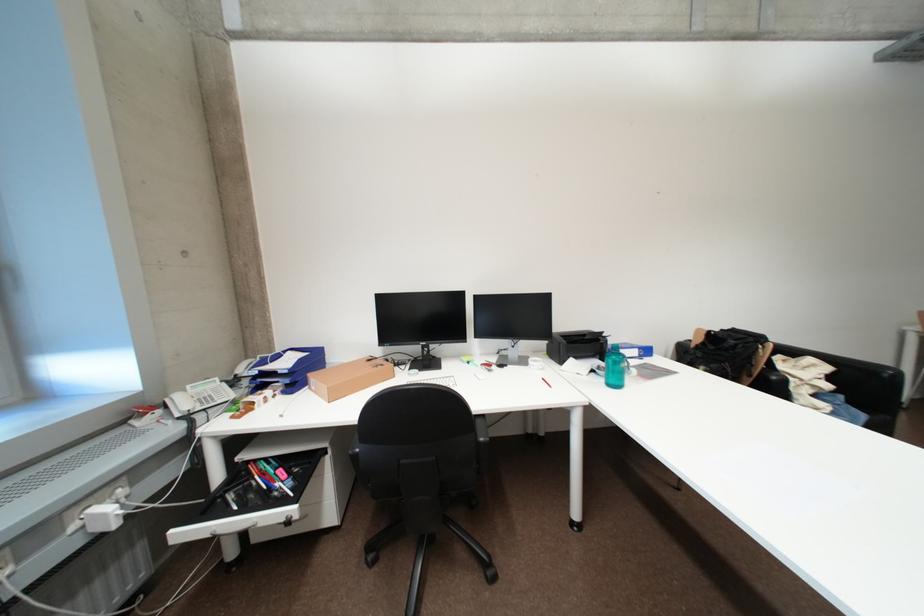
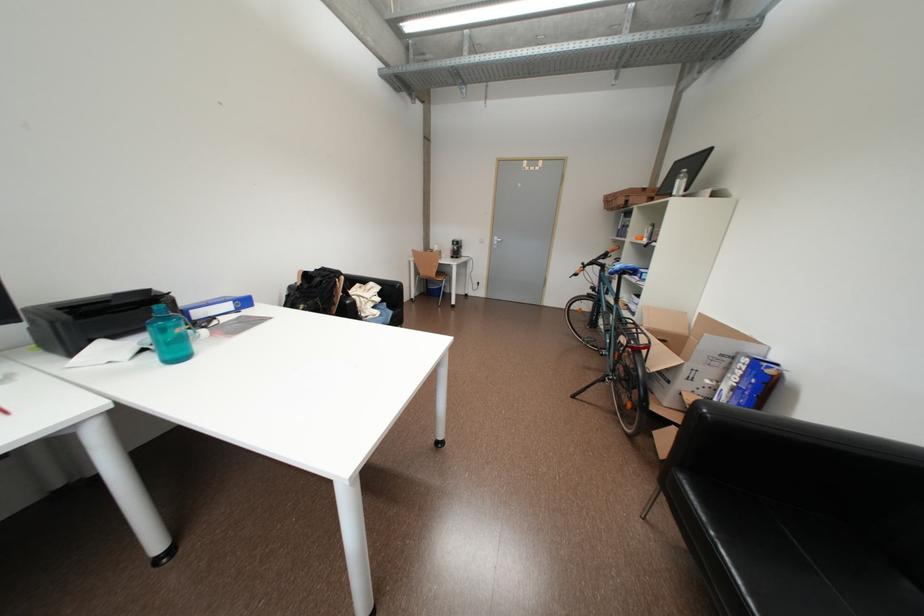
Question: The camera is either moving clockwise (left) or counter-clockwise (right) around the object. The first image is from the beginning of the video and the second image is from the end. Is the camera moving left or right when shooting the video?

Choices:
 (A) Left
 (B) Right

Answer: (A)